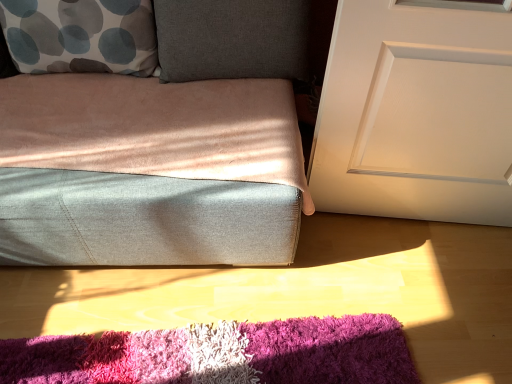
This screenshot has height=384, width=512. I want to click on vacant space behind shaggy multicolor rug at lower center, so click(x=243, y=282).